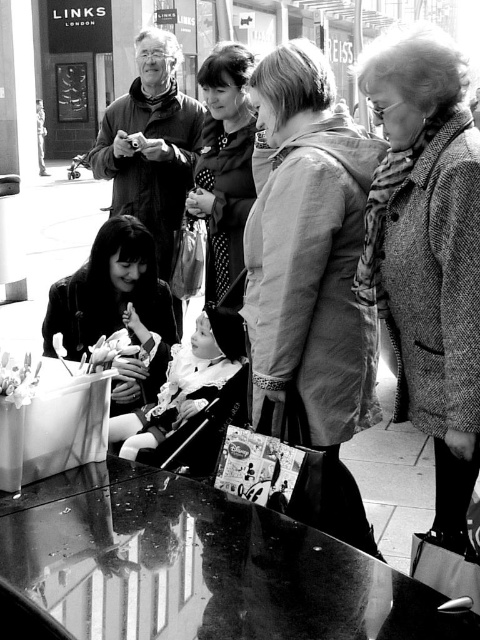
You are a photographer standing at a specific point in the scene. You want to capture a clear shot of the LINKS LONDON sign in the background without any obstructions. Given the glossy glass table at lower center, where should you position yourself to avoid its reflection interfering with the sign?

To avoid the reflection of the glossy glass table at lower center interfering with the LINKS LONDON sign, position yourself such that the line of sight to the sign does not pass over the table. Since the table is at point (199, 564), moving to a position where you are not directly in line with the table relative to the sign would ensure a clear shot.

You are a photographer trying to capture the glossy glass table at lower center and the matte black jacket at upper left in a single frame. Based on their sizes, which object would appear larger in the photo?

The glossy glass table at lower center would appear larger in the photo since its width is greater than that of the matte black jacket at upper left.